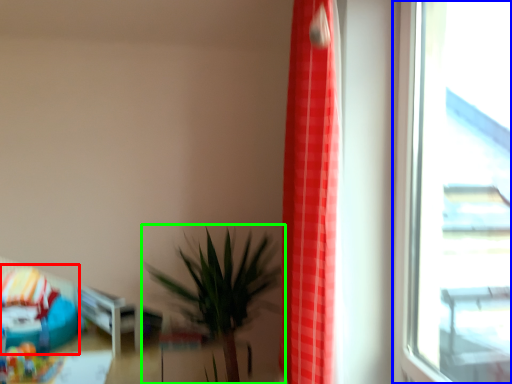
Question: Which object is positioned farthest from bean bag chair (highlighted by a red box)? Select from window (highlighted by a blue box) and houseplant (highlighted by a green box).

Choices:
 (A) window
 (B) houseplant

Answer: (A)